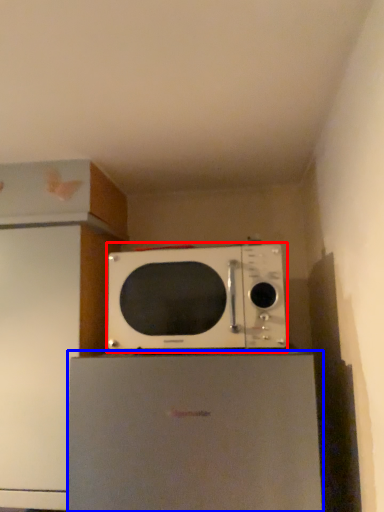
Question: Which of the following is the closest to the observer, microwave oven (highlighted by a red box) or appliance (highlighted by a blue box)?

Choices:
 (A) microwave oven
 (B) appliance

Answer: (B)